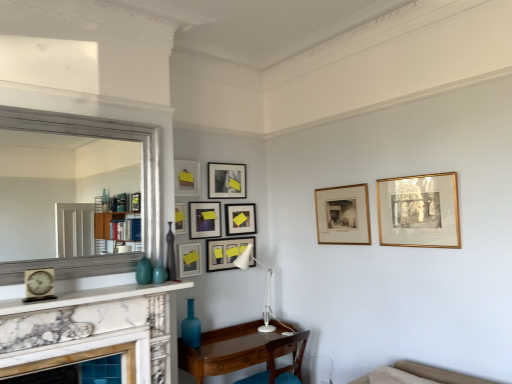
Question: Is gold framed print at upper right, the 9th picture frame viewed from the left, positioned far away from matte ceramic vase at center, which ranks as the 2th turquoise in left-to-right order?

Choices:
 (A) no
 (B) yes

Answer: (B)

Question: Considering the relative sizes of gold framed print at upper right, which appears as the first picture frame when viewed from the right, and matte ceramic vase at center, arranged as the first turquoise when viewed from the right, in the image provided, is gold framed print at upper right, which appears as the first picture frame when viewed from the right, wider than matte ceramic vase at center, arranged as the first turquoise when viewed from the right,?

Choices:
 (A) no
 (B) yes

Answer: (A)

Question: Is gold framed print at upper right, which appears as the first picture frame when viewed from the right, directly adjacent to matte ceramic vase at center, arranged as the first turquoise when viewed from the right?

Choices:
 (A) yes
 (B) no

Answer: (B)

Question: Can you confirm if gold framed print at upper right, the 9th picture frame viewed from the left, is bigger than matte ceramic vase at center, which ranks as the 2th turquoise in left-to-right order?

Choices:
 (A) no
 (B) yes

Answer: (B)

Question: Can you confirm if gold framed print at upper right, which appears as the first picture frame when viewed from the right, is taller than matte ceramic vase at center, arranged as the first turquoise when viewed from the right?

Choices:
 (A) no
 (B) yes

Answer: (B)

Question: From the image's perspective, is brown wooden chair at lower center above or below matte ceramic vase at center, which ranks as the 2th turquoise in left-to-right order?

Choices:
 (A) above
 (B) below

Answer: (B)

Question: In the image, is brown wooden chair at lower center positioned in front of or behind matte ceramic vase at center, arranged as the first turquoise when viewed from the right?

Choices:
 (A) front
 (B) behind

Answer: (B)

Question: Based on their positions, is brown wooden chair at lower center located to the left or right of matte ceramic vase at center, which ranks as the 2th turquoise in left-to-right order?

Choices:
 (A) left
 (B) right

Answer: (B)

Question: Is point (282, 337) positioned closer to the camera than point (162, 269)?

Choices:
 (A) closer
 (B) farther

Answer: (B)

Question: Is brown wooden chair at lower center to the left or to the right of matte gold picture frame at upper center, placed as the 8th picture frame when sorted from right to left, in the image?

Choices:
 (A) right
 (B) left

Answer: (A)

Question: Relative to matte gold picture frame at upper center, placed as the 8th picture frame when sorted from right to left, is brown wooden chair at lower center in front or behind?

Choices:
 (A) front
 (B) behind

Answer: (A)

Question: Do you think brown wooden chair at lower center is within matte gold picture frame at upper center, the second picture frame positioned from the left, or outside of it?

Choices:
 (A) inside
 (B) outside

Answer: (B)

Question: Is point (267, 367) positioned closer to the camera than point (196, 163)?

Choices:
 (A) farther
 (B) closer

Answer: (B)

Question: From the image's perspective, is wooden picture frame at center, acting as the eighth picture frame starting from the left, positioned above or below marble fireplace at lower left?

Choices:
 (A) above
 (B) below

Answer: (A)

Question: Relative to marble fireplace at lower left, is wooden picture frame at center, arranged as the 2th picture frame when viewed from the right, in front or behind?

Choices:
 (A) behind
 (B) front

Answer: (A)